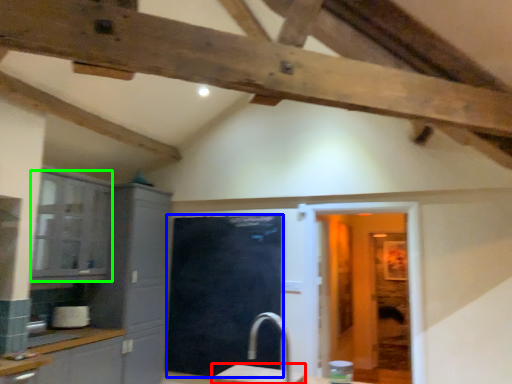
Question: Estimate the real-world distances between objects in this image. Which object is farther from table (highlighted by a red box), glass door (highlighted by a blue box) or cabinetry (highlighted by a green box)?

Choices:
 (A) glass door
 (B) cabinetry

Answer: (B)